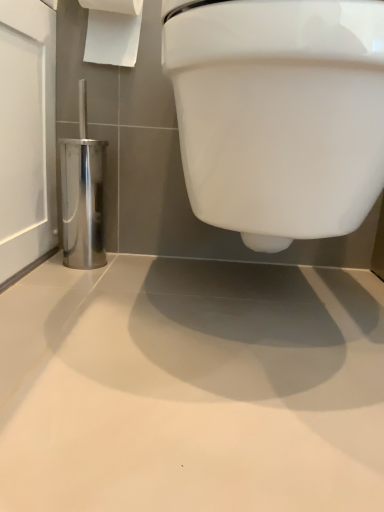
What do you see at coordinates (83, 195) in the screenshot? I see `polished metallic toilet brush holder at left` at bounding box center [83, 195].

Where is `white glossy toilet at upper center`? white glossy toilet at upper center is located at coordinates (278, 114).

The width and height of the screenshot is (384, 512). I want to click on polished metallic toilet brush holder at left, so click(x=83, y=195).

From the image's perspective, who appears lower, polished metallic toilet brush holder at left or white glossy toilet at upper center?

white glossy toilet at upper center, from the image's perspective.

Between polished metallic toilet brush holder at left and white glossy toilet at upper center, which one has smaller width?

Thinner between the two is polished metallic toilet brush holder at left.

Consider the image. From a real-world perspective, between polished metallic toilet brush holder at left and white glossy toilet at upper center, who is vertically higher?

white glossy toilet at upper center is physically above.

Which of these two, white glossy toilet at upper center or white paper at upper left, is wider?

white glossy toilet at upper center.

From the image's perspective, is white glossy toilet at upper center positioned above or below white paper at upper left?

Based on their image positions, white glossy toilet at upper center is located beneath white paper at upper left.

Considering the relative positions of white glossy toilet at upper center and white paper at upper left in the image provided, is white glossy toilet at upper center to the right of white paper at upper left from the viewer's perspective?

Yes.

You are a GUI agent. You are given a task and a screenshot of the screen. Output one action in this format:
    pyautogui.click(x=<x>, y=<y>)
    Task: Click on the toilet paper lying on the left of white glossy toilet at upper center
    This screenshot has width=384, height=512.
    Given the screenshot: What is the action you would take?
    pyautogui.click(x=112, y=31)

Is white glossy toilet at upper center far away from polished metallic toilet brush holder at left?

No.

In the scene shown: Which of these two, white glossy toilet at upper center or polished metallic toilet brush holder at left, is smaller?

polished metallic toilet brush holder at left is smaller.

From a real-world perspective, is white glossy toilet at upper center physically above polished metallic toilet brush holder at left?

Yes, from a real-world perspective, white glossy toilet at upper center is on top of polished metallic toilet brush holder at left.

Considering the relative sizes of white glossy toilet at upper center and polished metallic toilet brush holder at left in the image provided, is white glossy toilet at upper center shorter than polished metallic toilet brush holder at left?

No, white glossy toilet at upper center is not shorter than polished metallic toilet brush holder at left.

Is white paper at upper left in front of polished metallic toilet brush holder at left?

Yes, the depth of white paper at upper left is less than that of polished metallic toilet brush holder at left.

Are white paper at upper left and polished metallic toilet brush holder at left far apart?

No.

Between white paper at upper left and polished metallic toilet brush holder at left, which one has less height?

white paper at upper left is shorter.

In the image, is white paper at upper left positioned in front of or behind white glossy toilet at upper center?

Visually, white paper at upper left is located behind white glossy toilet at upper center.

Is there a large distance between white paper at upper left and white glossy toilet at upper center?

No, white paper at upper left is not far away from white glossy toilet at upper center.

Is white paper at upper left facing towards white glossy toilet at upper center?

No, white paper at upper left is not aimed at white glossy toilet at upper center.

Is polished metallic toilet brush holder at left beside white paper at upper left?

No, polished metallic toilet brush holder at left is not making contact with white paper at upper left.

From the image's perspective, is polished metallic toilet brush holder at left located above or below white paper at upper left?

Based on their image positions, polished metallic toilet brush holder at left is located beneath white paper at upper left.

Is polished metallic toilet brush holder at left taller or shorter than white paper at upper left?

In the image, polished metallic toilet brush holder at left appears to be taller than white paper at upper left.

From a real-world perspective, relative to white paper at upper left, is polished metallic toilet brush holder at left vertically above or below?

In terms of real-world spatial position, polished metallic toilet brush holder at left is below white paper at upper left.

Locate an element on the screen. toilet in front of the polished metallic toilet brush holder at left is located at coordinates (278, 114).

Where is `toilet below the white paper at upper left (from a real-world perspective)`? toilet below the white paper at upper left (from a real-world perspective) is located at coordinates (278, 114).

Which object lies further to the anchor point polished metallic toilet brush holder at left, white glossy toilet at upper center or white paper at upper left?

Among the two, white glossy toilet at upper center is located further to polished metallic toilet brush holder at left.

From the image, which object appears to be nearer to white paper at upper left, white glossy toilet at upper center or polished metallic toilet brush holder at left?

Among the two, polished metallic toilet brush holder at left is located nearer to white paper at upper left.

Estimate the real-world distances between objects in this image. Which object is closer to white paper at upper left, polished metallic toilet brush holder at left or white glossy toilet at upper center?

Based on the image, polished metallic toilet brush holder at left appears to be nearer to white paper at upper left.

Considering their positions, is white paper at upper left positioned further to polished metallic toilet brush holder at left than white glossy toilet at upper center?

white glossy toilet at upper center lies further to polished metallic toilet brush holder at left than the other object.

When comparing their distances from white glossy toilet at upper center, does white paper at upper left or polished metallic toilet brush holder at left seem closer?

Based on the image, polished metallic toilet brush holder at left appears to be nearer to white glossy toilet at upper center.

When comparing their distances from white glossy toilet at upper center, does polished metallic toilet brush holder at left or white paper at upper left seem further?

Based on the image, white paper at upper left appears to be further to white glossy toilet at upper center.

You are a GUI agent. You are given a task and a screenshot of the screen. Output one action in this format:
    pyautogui.click(x=<x>, y=<y>)
    Task: Click on the toilet paper between white glossy toilet at upper center and polished metallic toilet brush holder at left in the front-back direction
    
    Given the screenshot: What is the action you would take?
    pyautogui.click(x=112, y=31)